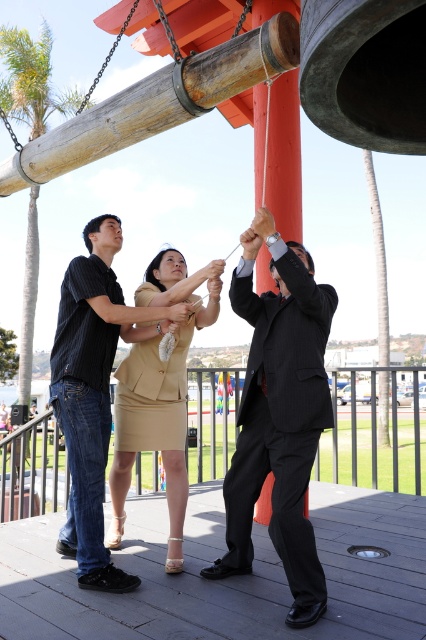
You are a photographer positioned at the origin point of the image. You need to capture a photo of the beige fabric dress at center. Which direction should you point your camera to ensure the dress is in the frame?

You should point your camera towards the coordinates point at (279, 413) to capture the beige fabric dress at center.

You are a photographer standing on the wooden deck and want to take a photo of the beige fabric dress at center and the beige fabric skirt at center. Which one is on the right side when facing the scene?

The beige fabric dress at center is positioned on the right side of the beige fabric skirt at center, so when facing the scene, the beige fabric dress at center is on the right side.

You are a photographer trying to capture a candid shot of the beige fabric dress at center and the beige fabric skirt at center. Since you want to ensure both are fully visible in the frame, which clothing item should you focus on to avoid cropping the top part of the image?

You should focus on the beige fabric dress at center because it has a greater height compared to the beige fabric skirt at center, so ensuring the top of the dress is in frame will also include the shorter skirt.